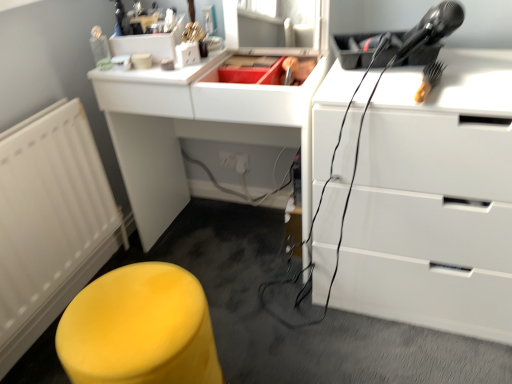
Where is `vacant area that is in front of yellow plastic brush at upper right`? The width and height of the screenshot is (512, 384). vacant area that is in front of yellow plastic brush at upper right is located at coordinates (455, 100).